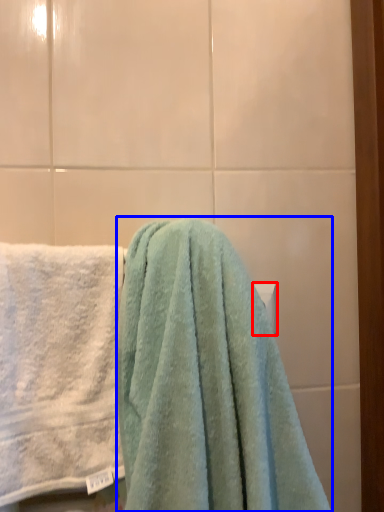
Question: Which point is further to the camera, towel bar (highlighted by a red box) or towel (highlighted by a blue box)?

Choices:
 (A) towel bar
 (B) towel

Answer: (A)